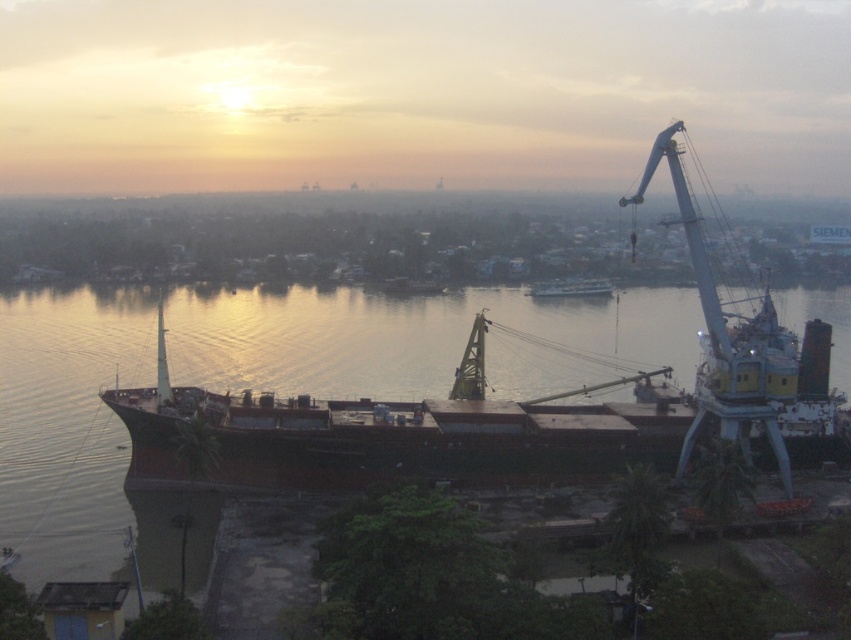
What is the exact coordinate of the brown matte water at center?

The brown matte water at center is located at point (83,440).

You are a sailor who needs to board the metallic gray boat at center. Based on the scene, is the brown matte water at center an obstacle in your path to reach the boat?

The brown matte water at center is much taller than the metallic gray boat at center, so it might be an obstacle in your path to reach the boat.